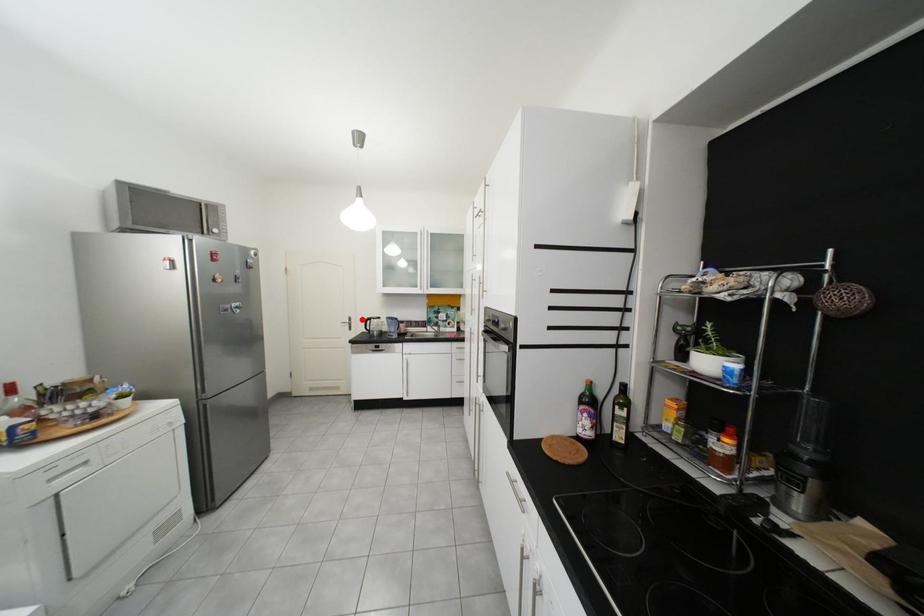
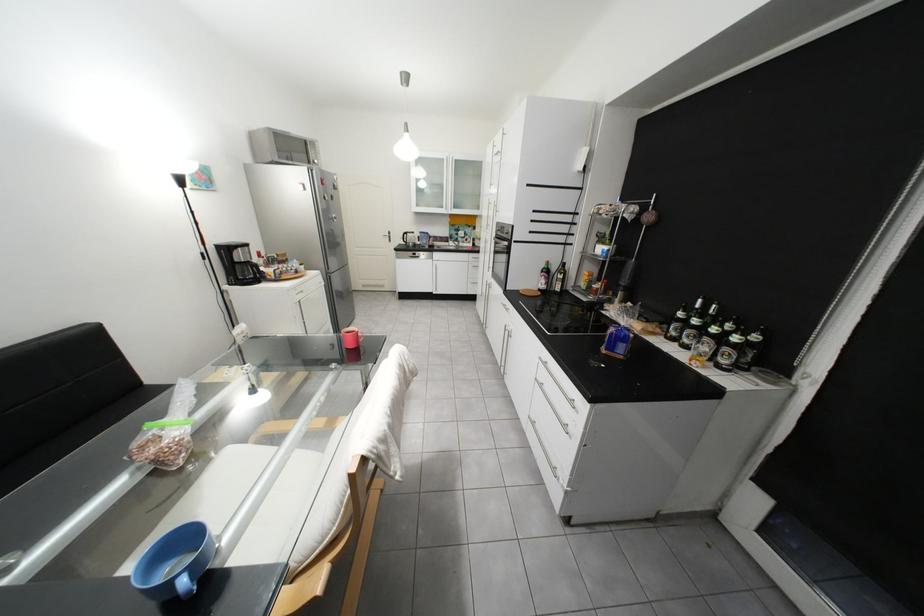
Question: A red point is marked in image1. In image2, is the corresponding 3D point closer to the camera or farther? Reply with the corresponding letter.

Choices:
 (A) The corresponding 3D point is closer.
 (B) The corresponding 3D point is farther.

Answer: (A)